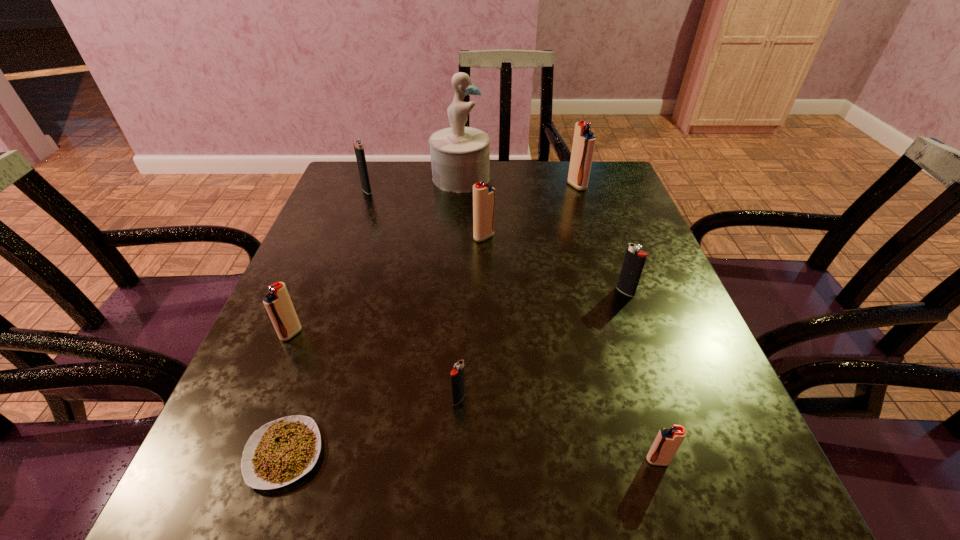
The image size is (960, 540). I want to click on the leftmost red igniter, so click(x=278, y=304).

You are a GUI agent. You are given a task and a screenshot of the screen. Output one action in this format:
    pyautogui.click(x=<x>, y=<y>)
    Task: Click on the leftmost igniter
    This screenshot has width=960, height=540.
    Given the screenshot: What is the action you would take?
    pyautogui.click(x=278, y=304)

You are a GUI agent. You are given a task and a screenshot of the screen. Output one action in this format:
    pyautogui.click(x=<x>, y=<y>)
    Task: Click on the nearest red igniter
    
    Given the screenshot: What is the action you would take?
    pyautogui.click(x=668, y=440)

The height and width of the screenshot is (540, 960). Identify the location of the smallest red igniter. (668, 440).

The width and height of the screenshot is (960, 540). I want to click on the third nearest object, so click(x=457, y=373).

Locate an element on the screen. The width and height of the screenshot is (960, 540). the sixth farthest igniter is located at coordinates (457, 373).

Where is `the shortest object`? The image size is (960, 540). the shortest object is located at coordinates (280, 452).

At what (x,y) coordinates should I click in order to perform the action: click on free space located at the beak of the figurine. Please return your answer as a coordinate pair (x, y). The height and width of the screenshot is (540, 960). Looking at the image, I should click on coord(588,178).

Where is `vacant space located on the left of the farthest red igniter`? vacant space located on the left of the farthest red igniter is located at coordinates (424, 186).

Find the location of a particular element. The image size is (960, 540). free spot located 0.120m on the back of the second farthest red igniter is located at coordinates (484, 204).